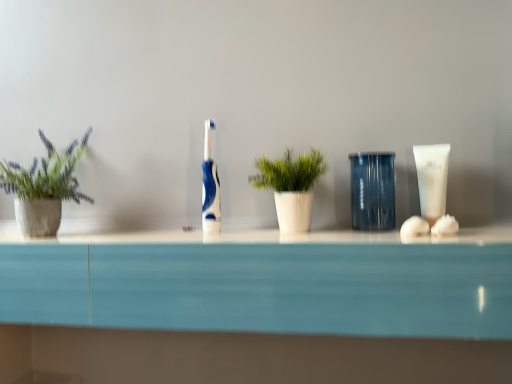
Question: Considering the relative positions of green glossy plant at center, arranged as the 2th houseplant when viewed from the left, and transparent plastic cup at center in the image provided, is green glossy plant at center, arranged as the 2th houseplant when viewed from the left, in front of transparent plastic cup at center?

Choices:
 (A) yes
 (B) no

Answer: (A)

Question: Does green glossy plant at center, arranged as the 2th houseplant when viewed from the left, have a greater width compared to transparent plastic cup at center?

Choices:
 (A) no
 (B) yes

Answer: (B)

Question: Is green glossy plant at center, arranged as the 2th houseplant when viewed from the left, outside transparent plastic cup at center?

Choices:
 (A) no
 (B) yes

Answer: (B)

Question: Is transparent plastic cup at center at the back of green glossy plant at center, arranged as the 2th houseplant when viewed from the left?

Choices:
 (A) yes
 (B) no

Answer: (B)

Question: From the image's perspective, does green glossy plant at center, acting as the first houseplant starting from the right, appear higher than transparent plastic cup at center?

Choices:
 (A) no
 (B) yes

Answer: (A)

Question: From the image's perspective, would you say green glossy plant at center, arranged as the 2th houseplant when viewed from the left, is shown under transparent plastic cup at center?

Choices:
 (A) yes
 (B) no

Answer: (A)

Question: Is transparent plastic cup at center far from blue glossy toothbrush at center?

Choices:
 (A) no
 (B) yes

Answer: (A)

Question: From the image's perspective, is transparent plastic cup at center beneath blue glossy toothbrush at center?

Choices:
 (A) yes
 (B) no

Answer: (A)

Question: Considering the relative sizes of transparent plastic cup at center and blue glossy toothbrush at center in the image provided, is transparent plastic cup at center smaller than blue glossy toothbrush at center?

Choices:
 (A) yes
 (B) no

Answer: (B)

Question: Would you say transparent plastic cup at center is outside blue glossy toothbrush at center?

Choices:
 (A) no
 (B) yes

Answer: (B)

Question: Is transparent plastic cup at center thinner than blue glossy toothbrush at center?

Choices:
 (A) no
 (B) yes

Answer: (A)

Question: From a real-world perspective, is transparent plastic cup at center under blue glossy toothbrush at center?

Choices:
 (A) no
 (B) yes

Answer: (B)

Question: Considering the relative sizes of white matte tube at right and green leafy plant in concrete pot at left, positioned as the 2th houseplant in right-to-left order, in the image provided, is white matte tube at right smaller than green leafy plant in concrete pot at left, positioned as the 2th houseplant in right-to-left order,?

Choices:
 (A) yes
 (B) no

Answer: (A)